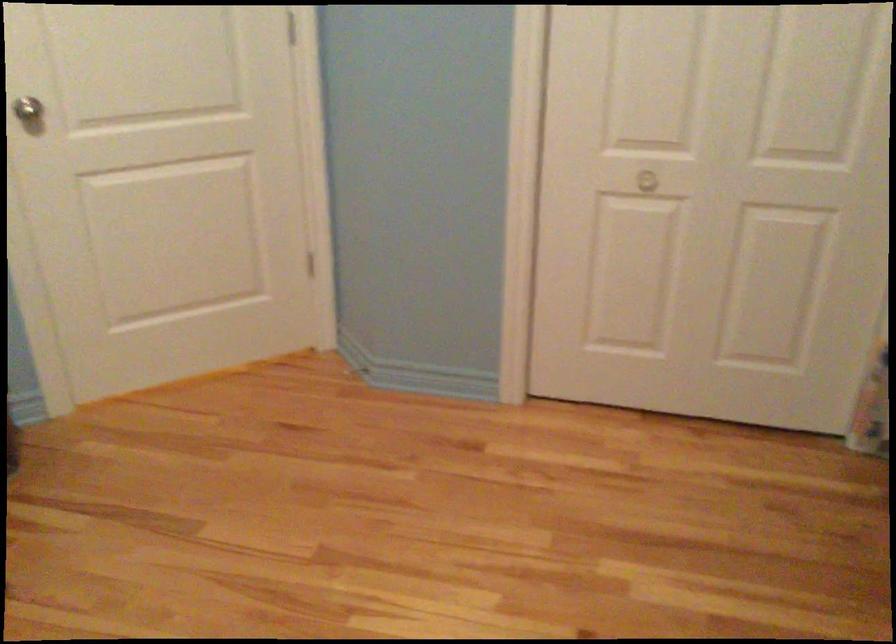
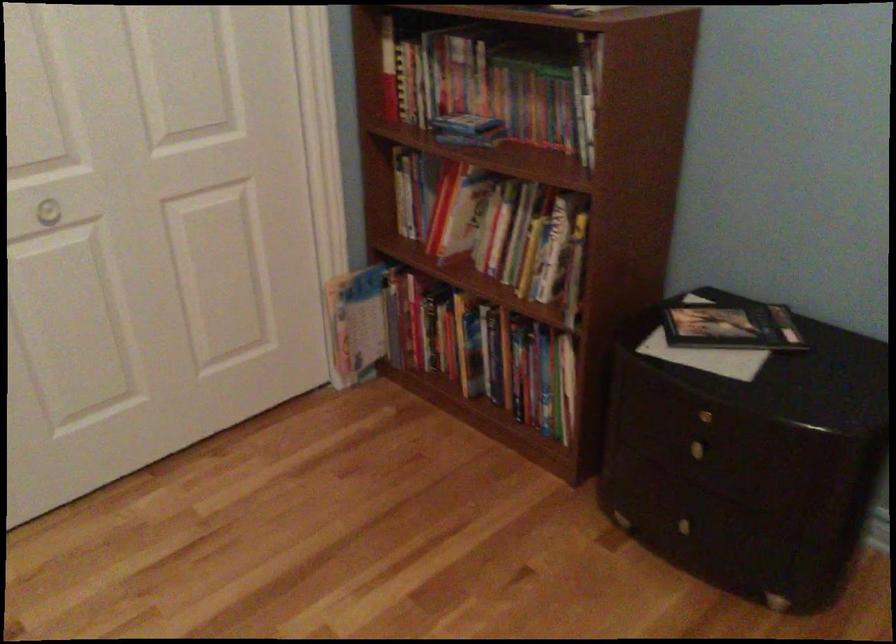
Question: The first image is from the beginning of the video and the second image is from the end. How did the camera likely rotate when shooting the video?

Choices:
 (A) Left
 (B) Right
 (C) Up
 (D) Down

Answer: (B)